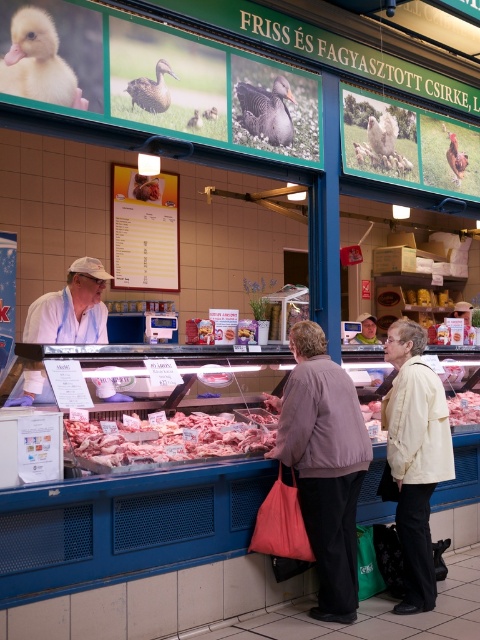
You are a customer at the butcher shop and see the light beige jacket at center and the pinkish raw meat at center. Which item is closer to you?

The light beige jacket at center is closer to you because it is below the pinkish raw meat at center, meaning it is positioned in front of it.